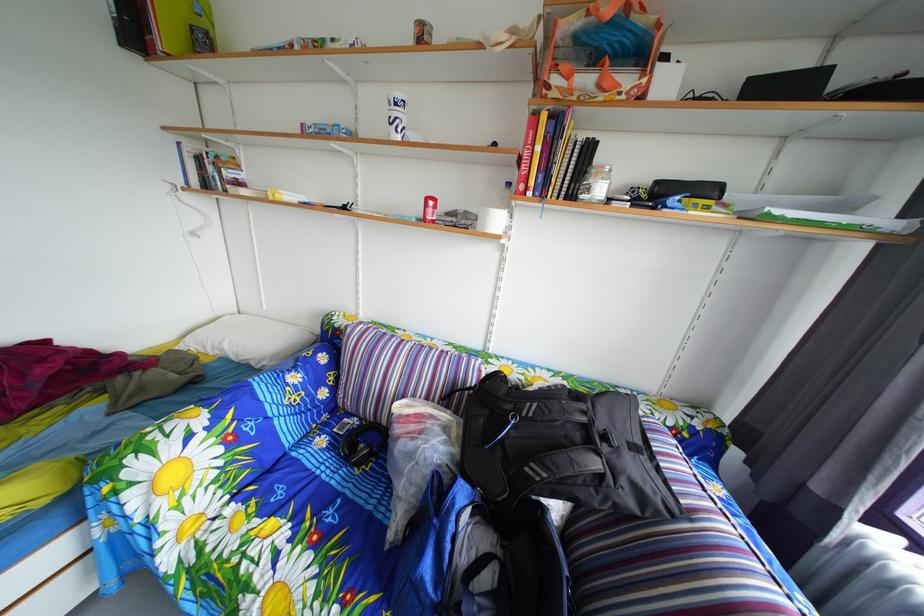
At what (x,y) coordinates should I click in order to perform the action: click on white paper cup. Please return your answer as a coordinate pair (x, y). Looking at the image, I should click on (396, 116).